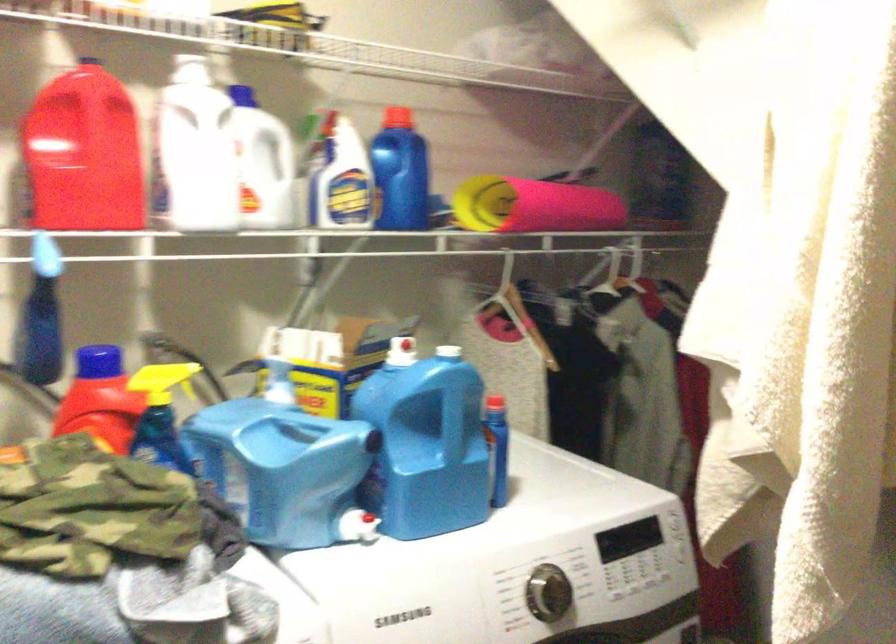
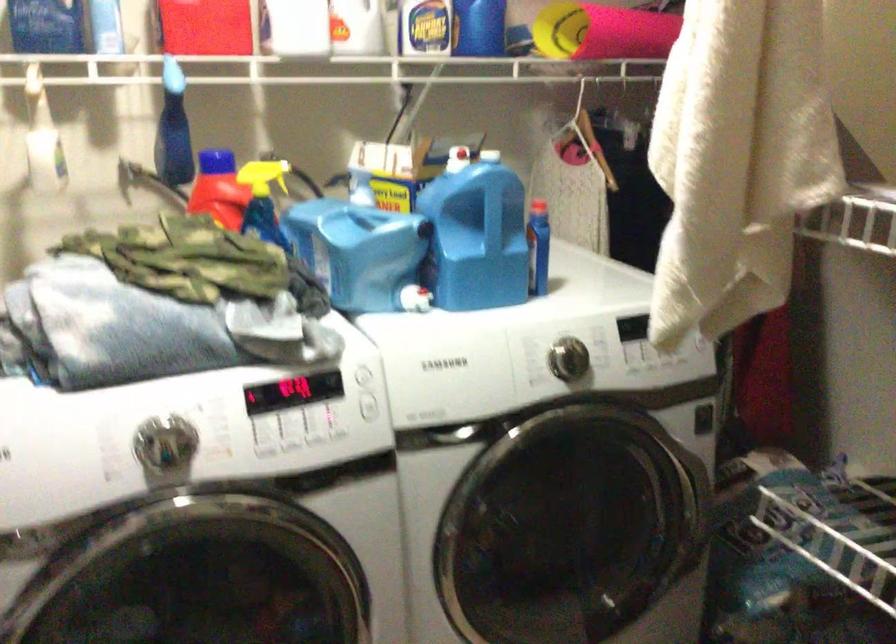
In the second image, find the point that corresponds to point 99,355 in the first image.

(217, 160)